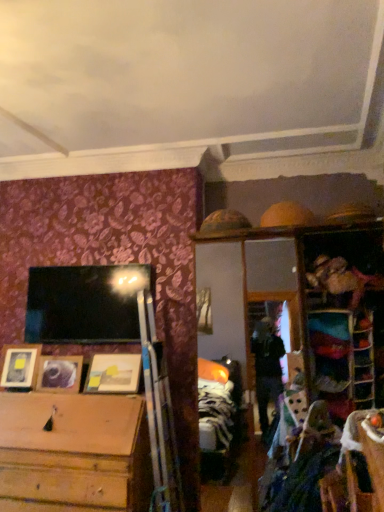
Question: From a real-world perspective, is wooden shelf at right, which is the second shelf in left-to-right order, physically located above or below wooden picture frame at left, which is the 2th picture frame in right-to-left order?

Choices:
 (A) above
 (B) below

Answer: (A)

Question: Based on their positions, is wooden shelf at right, which is the first shelf from right to left, located to the left or right of wooden picture frame at left, which is the 2th picture frame in right-to-left order?

Choices:
 (A) left
 (B) right

Answer: (B)

Question: Which of these objects is positioned closest to the wooden picture frame at lower left, which appears as the 1th picture frame when viewed from the left?

Choices:
 (A) wooden picture frame at center, which ranks as the third picture frame in left-to-right order
 (B) metallic reflective frame at upper right, the second shelf when ordered from right to left
 (C) wooden shelf at right, which is the second shelf in left-to-right order
 (D) wooden picture frame at left, the second picture frame viewed from the left

Answer: (D)

Question: Which is farther from the wooden shelf at right, which is the first shelf from right to left?

Choices:
 (A) wooden picture frame at center, which ranks as the third picture frame in left-to-right order
 (B) metallic reflective frame at upper right, the second shelf when ordered from right to left
 (C) wooden picture frame at lower left, which is counted as the third picture frame, starting from the right
 (D) wooden picture frame at left, the second picture frame viewed from the left

Answer: (C)